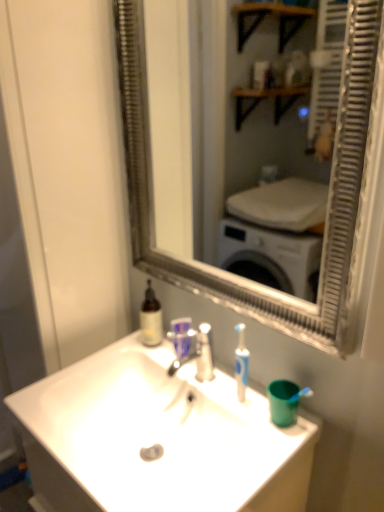
Locate an element on the screen. vacant area that is in front of translucent glass bottle at upper left is located at coordinates (167, 360).